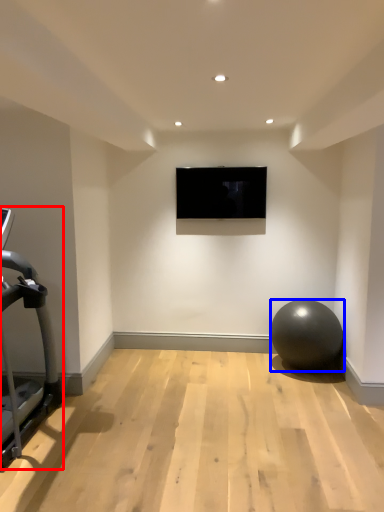
Question: Which object appears closest to the camera in this image, treadmill (highlighted by a red box) or ball (highlighted by a blue box)?

Choices:
 (A) treadmill
 (B) ball

Answer: (A)